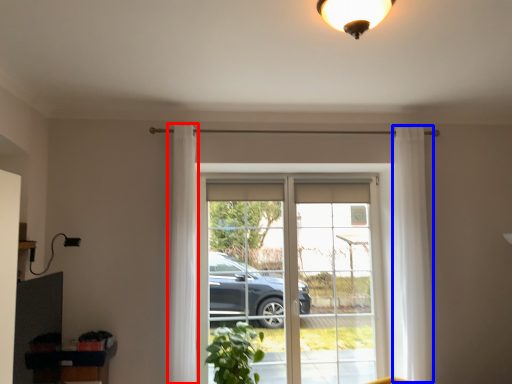
Question: Which of the following is the farthest to the observer, curtain (highlighted by a red box) or curtain (highlighted by a blue box)?

Choices:
 (A) curtain
 (B) curtain

Answer: (B)